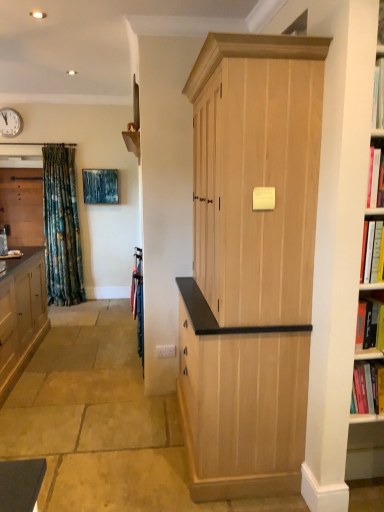
Question: From a real-world perspective, is metallic wall clock at upper left over matte wood cabinet at left, acting as the 1th cabinetry starting from the back?

Choices:
 (A) no
 (B) yes

Answer: (B)

Question: Is metallic wall clock at upper left surrounding matte wood cabinet at left, acting as the 1th cabinetry starting from the back?

Choices:
 (A) no
 (B) yes

Answer: (A)

Question: Does metallic wall clock at upper left have a larger size compared to matte wood cabinet at left, which is counted as the 3th cabinetry, starting from the right?

Choices:
 (A) yes
 (B) no

Answer: (B)

Question: Is metallic wall clock at upper left at the left side of matte wood cabinet at left, which is counted as the 1th cabinetry, starting from the left?

Choices:
 (A) yes
 (B) no

Answer: (B)

Question: Is metallic wall clock at upper left outside matte wood cabinet at left, the third cabinetry when ordered from front to back?

Choices:
 (A) no
 (B) yes

Answer: (B)

Question: Does metallic wall clock at upper left have a lesser height compared to matte wood cabinet at left, which is counted as the 3th cabinetry, starting from the right?

Choices:
 (A) no
 (B) yes

Answer: (B)

Question: From the image's perspective, is matte wood cabinet at left, which is counted as the 1th cabinetry, starting from the left, below natural wood cabinet at center, positioned as the 3th cabinetry in left-to-right order?

Choices:
 (A) yes
 (B) no

Answer: (B)

Question: Is matte wood cabinet at left, acting as the 1th cabinetry starting from the back, facing away from natural wood cabinet at center, which is counted as the 1th cabinetry, starting from the front?

Choices:
 (A) yes
 (B) no

Answer: (B)

Question: Can you confirm if matte wood cabinet at left, which is counted as the 3th cabinetry, starting from the right, is smaller than natural wood cabinet at center, which is counted as the 1th cabinetry, starting from the front?

Choices:
 (A) no
 (B) yes

Answer: (B)

Question: Is matte wood cabinet at left, the third cabinetry when ordered from front to back, at the right side of natural wood cabinet at center, which is counted as the 1th cabinetry, starting from the front?

Choices:
 (A) no
 (B) yes

Answer: (A)

Question: Is matte wood cabinet at left, the third cabinetry when ordered from front to back, in contact with natural wood cabinet at center, positioned as the 3th cabinetry in left-to-right order?

Choices:
 (A) no
 (B) yes

Answer: (A)

Question: From a real-world perspective, does matte wood cabinet at left, the third cabinetry when ordered from front to back, stand above natural wood cabinet at center, arranged as the third cabinetry when viewed from the back?

Choices:
 (A) no
 (B) yes

Answer: (A)

Question: Is natural wood cabinet at center, arranged as the third cabinetry when viewed from the back, positioned beyond the bounds of metallic wall clock at upper left?

Choices:
 (A) no
 (B) yes

Answer: (B)